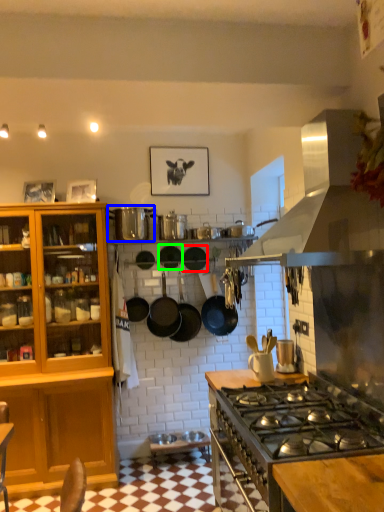
Question: Which object is positioned farthest from frying pan (highlighted by a red box)? Select from appliance (highlighted by a blue box) and frying pan (highlighted by a green box).

Choices:
 (A) appliance
 (B) frying pan

Answer: (A)